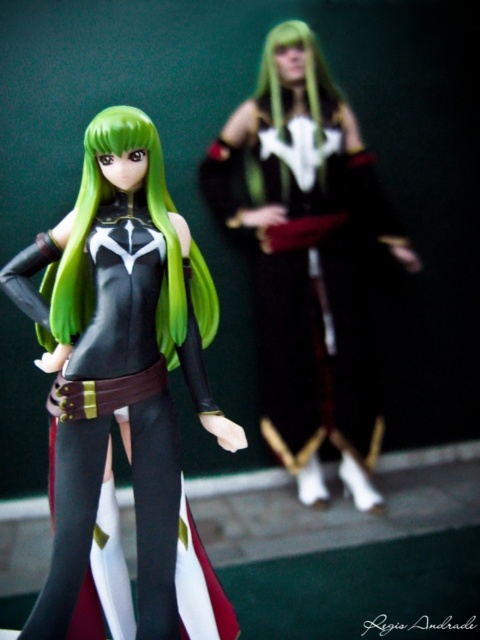
Question: Which point is closer to the camera?

Choices:
 (A) (85, 314)
 (B) (55, 547)
 (C) (57, 624)

Answer: (C)

Question: Which of the following is the closest to the observer?

Choices:
 (A) black matte tights at lower left
 (B) matte black figure at left

Answer: (B)

Question: Estimate the real-world distances between objects in this image. Which object is closer to the green matte hair at center?

Choices:
 (A) black matte tights at lower left
 (B) matte black figure at left
 (C) matte black dress at upper right

Answer: (B)

Question: Is matte black figure at left to the right of green matte hair at center from the viewer's perspective?

Choices:
 (A) yes
 (B) no

Answer: (B)

Question: Can you confirm if matte black figure at left is wider than green matte hair at center?

Choices:
 (A) no
 (B) yes

Answer: (B)

Question: Is matte black figure at left thinner than black matte tights at lower left?

Choices:
 (A) yes
 (B) no

Answer: (B)